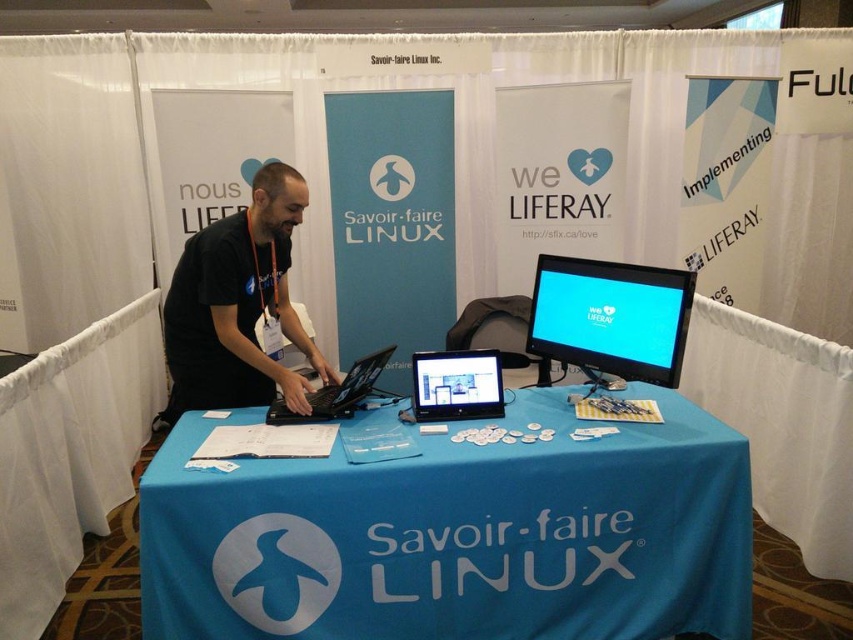
Is blue fabric tablecloth at center smaller than black matte laptop at center?

No, blue fabric tablecloth at center is not smaller than black matte laptop at center.

Does point (283, 496) come farther from viewer compared to point (361, 380)?

No, (283, 496) is in front of (361, 380).

Which is behind, point (440, 451) or point (283, 413)?

The point (283, 413) is behind.

Where is `blue fabric tablecloth at center`? blue fabric tablecloth at center is located at coordinates (457, 536).

Can you confirm if matte black monitor at upper right is positioned below black matte laptop at center?

No.

Which of these two, matte black monitor at upper right or black matte laptop at center, stands taller?

matte black monitor at upper right

Is point (648, 275) positioned behind point (361, 372)?

No, (648, 275) is in front of (361, 372).

Find the location of a particular element. The image size is (853, 640). matte black monitor at upper right is located at coordinates (610, 317).

This screenshot has width=853, height=640. In order to click on black fabric shirt at center in this screenshot , I will do `click(238, 305)`.

At what (x,y) coordinates should I click in order to perform the action: click on black fabric shirt at center. Please return your answer as a coordinate pair (x, y). The height and width of the screenshot is (640, 853). Looking at the image, I should click on (238, 305).

Where is `black fabric shirt at center`? Image resolution: width=853 pixels, height=640 pixels. black fabric shirt at center is located at coordinates 238,305.